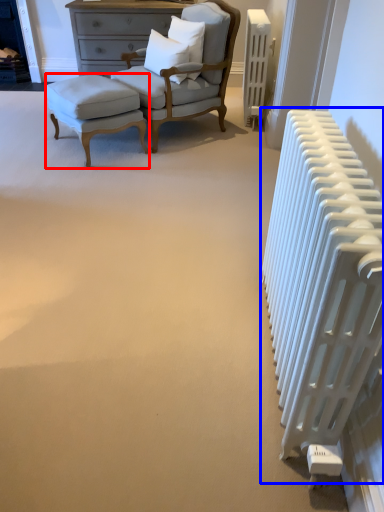
Question: Among these objects, which one is nearest to the camera, stool (highlighted by a red box) or radiator (highlighted by a blue box)?

Choices:
 (A) stool
 (B) radiator

Answer: (B)